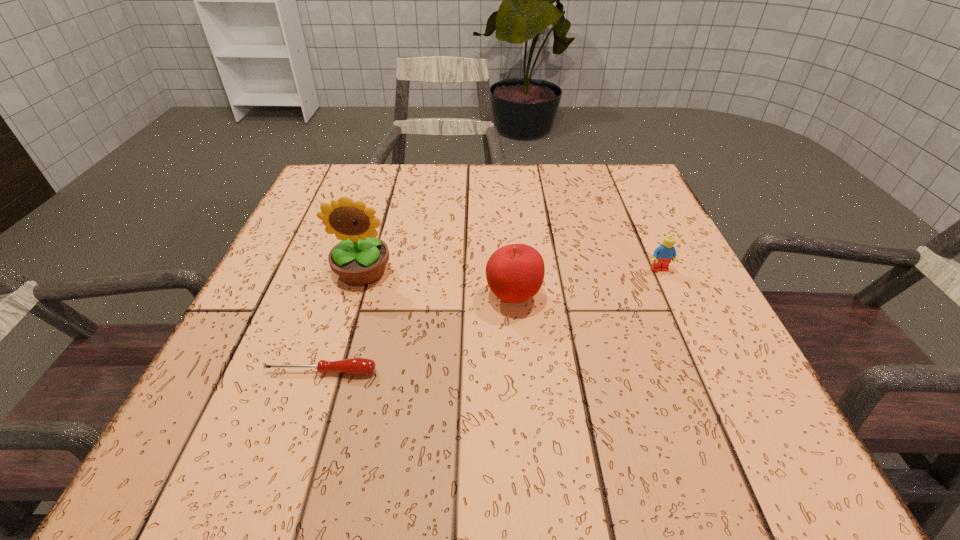
I want to click on free point that satisfies the following two spatial constraints: 1. on the face of the third object from left to right; 2. on the left side of the tallest object, so click(354, 297).

I want to click on free region that satisfies the following two spatial constraints: 1. on the face of the sunflower; 2. on the left side of the second tallest object, so click(x=354, y=297).

Find the location of a particular element. vacant space that satisfies the following two spatial constraints: 1. on the face of the apple; 2. on the right side of the tallest object is located at coordinates (354, 297).